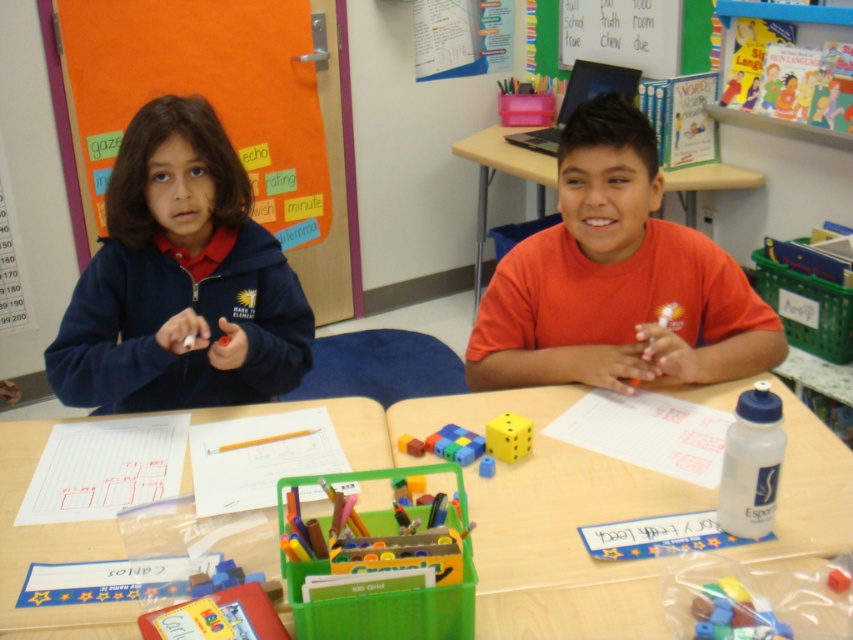
You are a teacher standing at the front of the classroom. You notice two points marked on the floor near the children. The first point is at coordinate point [346,253] and the second is at coordinate point [521,438]. If you want to walk from the first point to the second point, will you be moving forward or backward relative to the children sitting at the table?

Since point [346,253] is behind point [521,438], moving from the first point to the second point would mean moving forward towards the children sitting at the table.

You are a teacher observing the classroom scene. The wooden table at center is where the children are sitting. If you want to place a new textbook on the surface, will the rubber dice at center interfere with placing it?

The wooden table at center is much taller than the rubber dice at center, so there is sufficient space to place the textbook without interference from the dice.